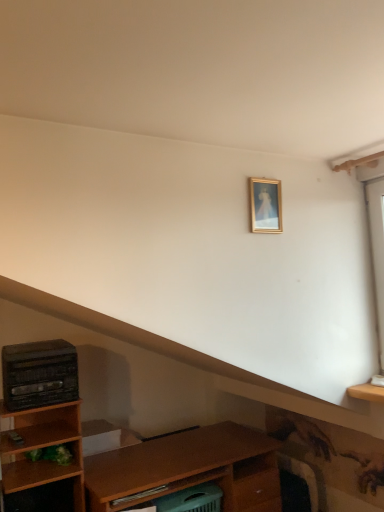
Question: Considering the relative sizes of gold-framed picture at upper center and black plastic stereo at left in the image provided, is gold-framed picture at upper center taller than black plastic stereo at left?

Choices:
 (A) yes
 (B) no

Answer: (B)

Question: Is gold-framed picture at upper center facing away from black plastic stereo at left?

Choices:
 (A) no
 (B) yes

Answer: (A)

Question: Is gold-framed picture at upper center at the right side of black plastic stereo at left?

Choices:
 (A) yes
 (B) no

Answer: (A)

Question: Is gold-framed picture at upper center bigger than black plastic stereo at left?

Choices:
 (A) no
 (B) yes

Answer: (A)

Question: Can you confirm if gold-framed picture at upper center is smaller than black plastic stereo at left?

Choices:
 (A) no
 (B) yes

Answer: (B)

Question: Would you consider gold-framed picture at upper center to be distant from black plastic stereo at left?

Choices:
 (A) no
 (B) yes

Answer: (B)

Question: Can gold-framed picture at upper center be found inside black plastic stereo at left?

Choices:
 (A) yes
 (B) no

Answer: (B)

Question: Is black plastic stereo at left directly adjacent to gold-framed picture at upper center?

Choices:
 (A) yes
 (B) no

Answer: (B)

Question: Can you confirm if black plastic stereo at left is smaller than gold-framed picture at upper center?

Choices:
 (A) yes
 (B) no

Answer: (B)

Question: Does black plastic stereo at left have a greater height compared to gold-framed picture at upper center?

Choices:
 (A) no
 (B) yes

Answer: (B)

Question: From a real-world perspective, is black plastic stereo at left over gold-framed picture at upper center?

Choices:
 (A) no
 (B) yes

Answer: (A)

Question: Considering the relative sizes of black plastic stereo at left and gold-framed picture at upper center in the image provided, is black plastic stereo at left shorter than gold-framed picture at upper center?

Choices:
 (A) yes
 (B) no

Answer: (B)

Question: Considering the positions of black plastic stereo at left and gold-framed picture at upper center in the image, is black plastic stereo at left taller or shorter than gold-framed picture at upper center?

Choices:
 (A) tall
 (B) short

Answer: (A)